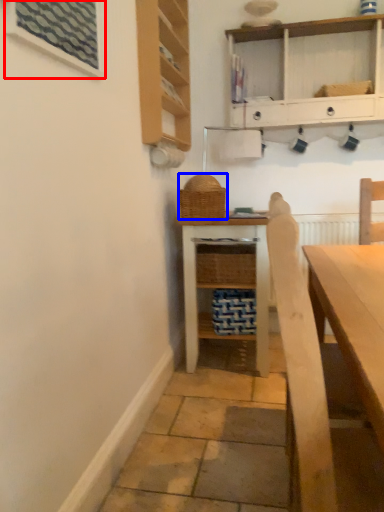
Question: Among these objects, which one is farthest to the camera, window (highlighted by a red box) or basket (highlighted by a blue box)?

Choices:
 (A) window
 (B) basket

Answer: (B)